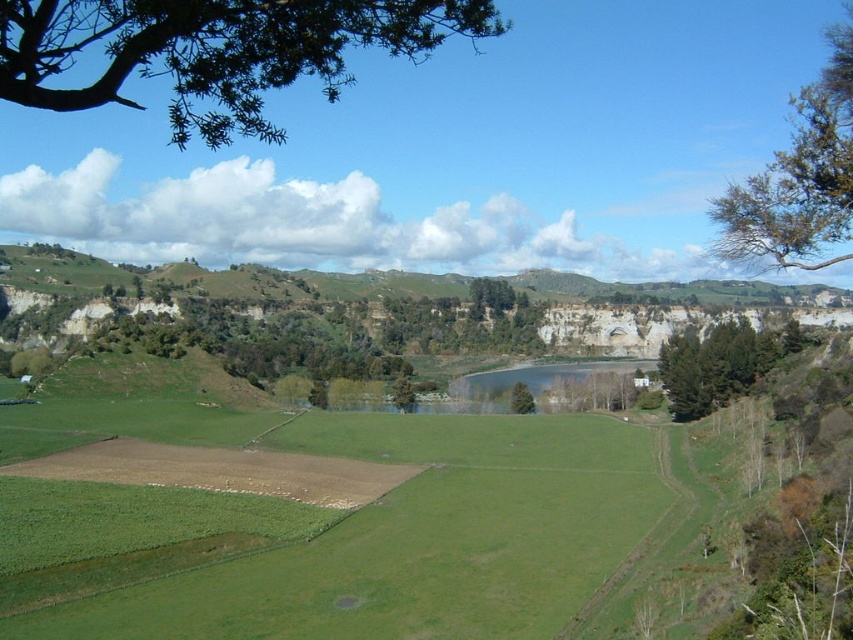
Question: Does green leafy tree at right have a lesser width compared to green grassy lake at center?

Choices:
 (A) no
 (B) yes

Answer: (B)

Question: Considering the relative positions of green leafy tree at right and green leafy tree at center in the image provided, where is green leafy tree at right located with respect to green leafy tree at center?

Choices:
 (A) right
 (B) left

Answer: (A)

Question: Which point is closer to the camera taking this photo?

Choices:
 (A) (827, 260)
 (B) (10, 33)
 (C) (752, 328)

Answer: (B)

Question: Which is nearer to the green leafy tree at center?

Choices:
 (A) green leafy tree at upper right
 (B) green leafy tree at right

Answer: (B)

Question: Does green leafy tree at upper left have a larger size compared to green leafy tree at center?

Choices:
 (A) yes
 (B) no

Answer: (A)

Question: Which of the following is the farthest from the observer?

Choices:
 (A) (718, 376)
 (B) (509, 404)
 (C) (57, 92)

Answer: (B)